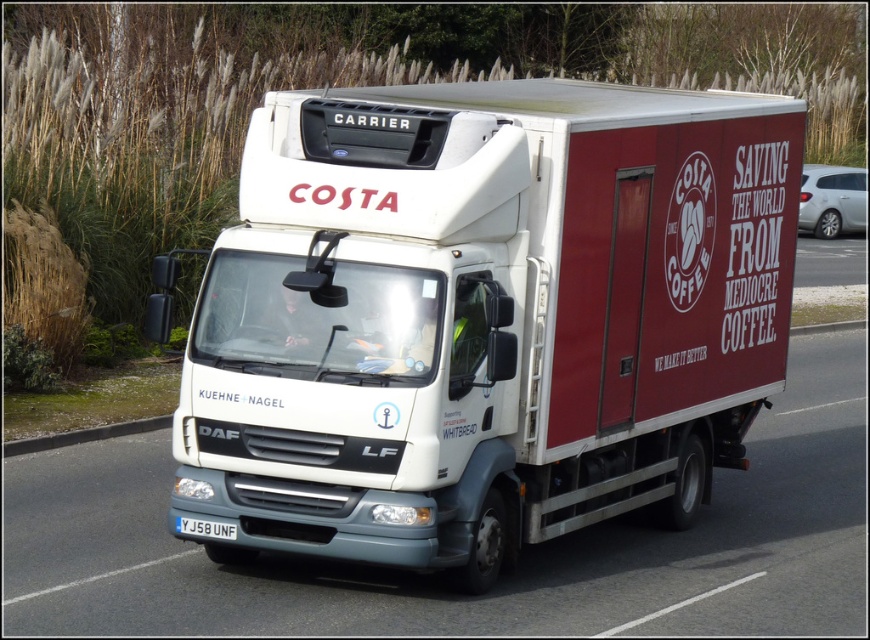
You are a traffic officer observing a vehicle. You notice a white matte truck at center and a white plastic license plate at center. Which object is located to the right of the other?

The white matte truck at center is positioned on the right side of white plastic license plate at center.

You are a photographer trying to capture the Costa delivery truck. You notice the white matte truck at center and the white plastic license plate at center. Which object should you focus on to get a larger subject in your photo?

The white matte truck at center is bigger than the white plastic license plate at center, so focusing on the white matte truck at center will result in a larger subject in the photo.